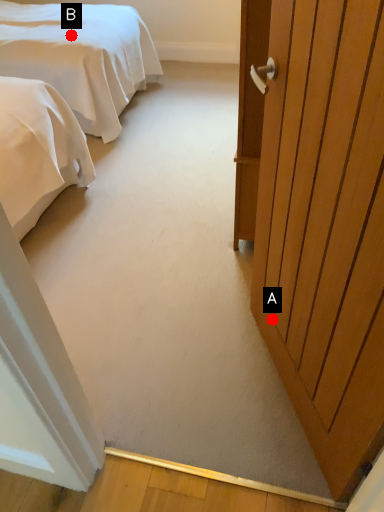
Question: Two points are circled on the image, labeled by A and B beside each circle. Which point is closer to the camera?

Choices:
 (A) A is closer
 (B) B is closer

Answer: (A)